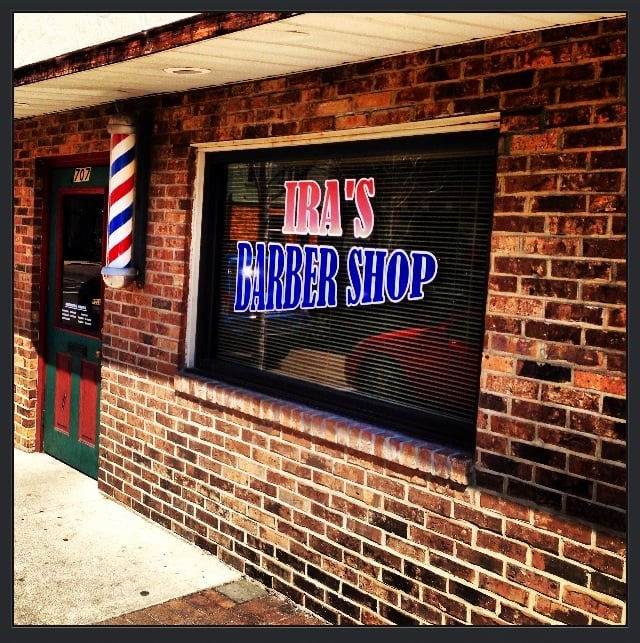
Where is `door handle`? The image size is (640, 643). door handle is located at coordinates (97, 354).